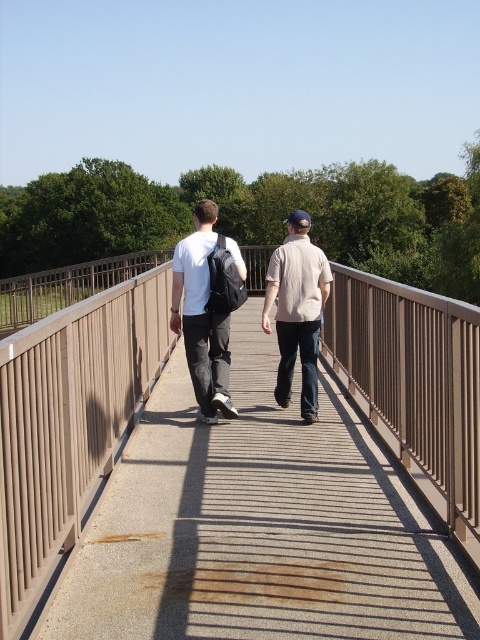
Question: Which of the following is the farthest from the observer?

Choices:
 (A) white matte backpack at center
 (B) matte black backpack at center
 (C) brown textured bridge at center

Answer: (B)

Question: Is brown textured bridge at center closer to the viewer compared to beige cotton shirt at center?

Choices:
 (A) yes
 (B) no

Answer: (A)

Question: Which point appears farthest from the camera in this image?

Choices:
 (A) (322, 296)
 (B) (227, 300)
 (C) (300, 483)
 (D) (179, 266)

Answer: (A)

Question: Does brown textured bridge at center have a greater width compared to white matte backpack at center?

Choices:
 (A) no
 (B) yes

Answer: (B)

Question: Observing the image, what is the correct spatial positioning of matte black backpack at center in reference to white matte backpack at center?

Choices:
 (A) below
 (B) above

Answer: (A)

Question: Based on their relative distances, which object is nearer to the matte black backpack at center?

Choices:
 (A) white matte backpack at center
 (B) beige cotton shirt at center

Answer: (A)